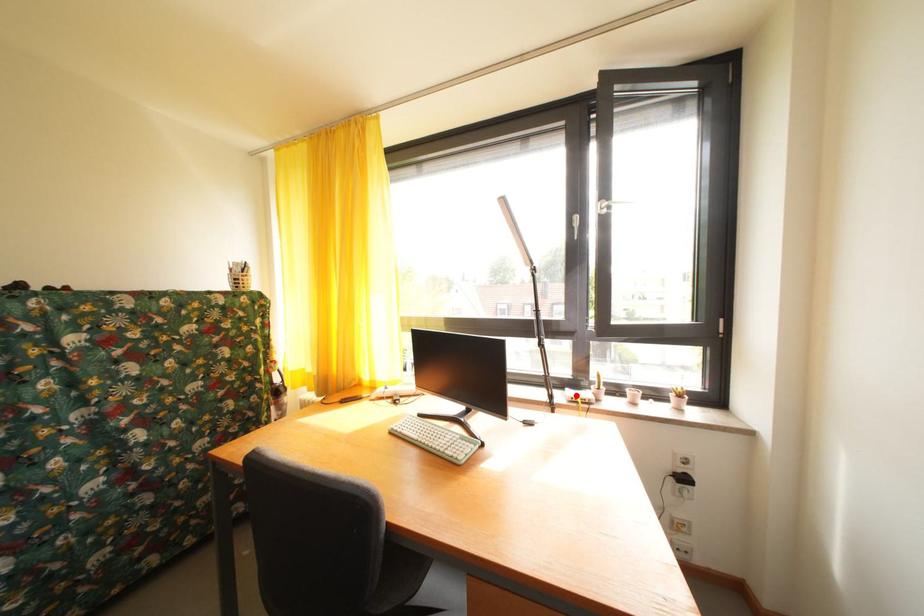
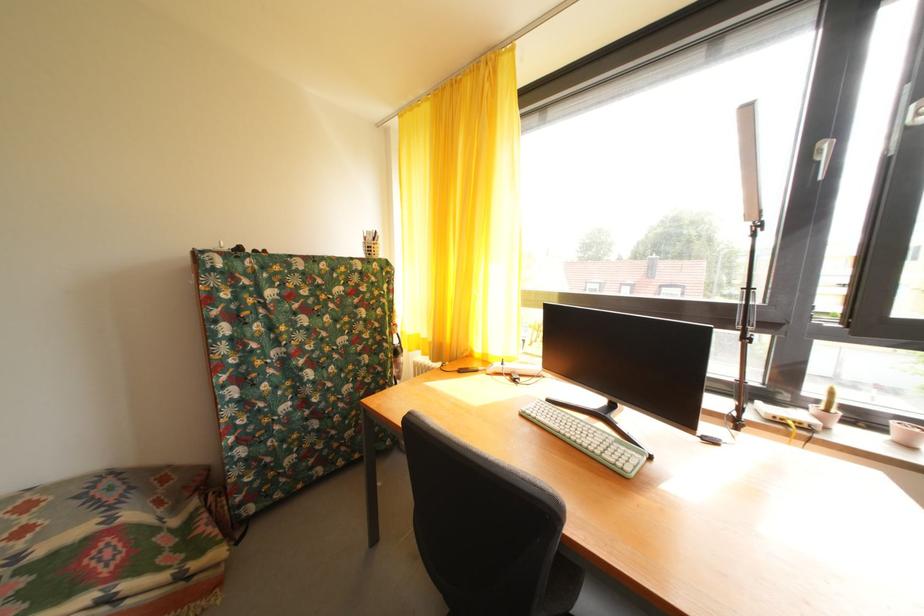
Question: I am providing you with two images of the same scene from different viewpoints. Given a red point in image1, look at the same physical point in image2. Is it:

Choices:
 (A) Closer to the viewpoint
 (B) Farther from the viewpoint

Answer: (A)